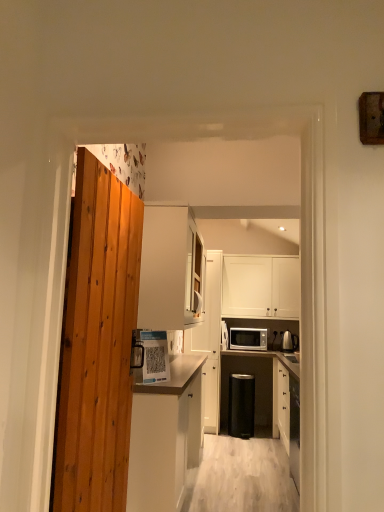
Question: Is white matte cabinet at upper center, the third cabinetry positioned from the right, to the right of white matte cabinet at center, arranged as the fourth cabinetry when viewed from the right, from the viewer's perspective?

Choices:
 (A) no
 (B) yes

Answer: (B)

Question: Is white matte cabinet at upper center, the third cabinetry positioned from the right, behind white matte cabinet at center, arranged as the fourth cabinetry when viewed from the right?

Choices:
 (A) no
 (B) yes

Answer: (B)

Question: Does white matte cabinet at upper center, the third cabinetry positioned from the right, have a smaller size compared to white matte cabinet at center, arranged as the fourth cabinetry when viewed from the right?

Choices:
 (A) no
 (B) yes

Answer: (B)

Question: Does white matte cabinet at upper center, the third cabinetry positioned from the right, have a lesser height compared to white matte cabinet at center, arranged as the fourth cabinetry when viewed from the right?

Choices:
 (A) yes
 (B) no

Answer: (A)

Question: Considering the relative sizes of white matte cabinet at upper center, the second cabinetry viewed from the left, and white matte cabinet at center, arranged as the fourth cabinetry when viewed from the right, in the image provided, is white matte cabinet at upper center, the second cabinetry viewed from the left, taller than white matte cabinet at center, arranged as the fourth cabinetry when viewed from the right,?

Choices:
 (A) yes
 (B) no

Answer: (B)

Question: Considering the positions of white glossy paper at center, the first appliance viewed from the left, and white matte cabinet at upper center, the third cabinetry positioned from the right, in the image, is white glossy paper at center, the first appliance viewed from the left, bigger or smaller than white matte cabinet at upper center, the third cabinetry positioned from the right,?

Choices:
 (A) big
 (B) small

Answer: (B)

Question: Relative to white matte cabinet at upper center, the second cabinetry viewed from the left, is white glossy paper at center, the first appliance viewed from the left, in front or behind?

Choices:
 (A) behind
 (B) front

Answer: (B)

Question: In terms of height, does white glossy paper at center, the 3th appliance in the back-to-front sequence, look taller or shorter compared to white matte cabinet at upper center, the third cabinetry positioned from the right?

Choices:
 (A) short
 (B) tall

Answer: (A)

Question: From a real-world perspective, is white glossy paper at center, the 3th appliance in the back-to-front sequence, above or below white matte cabinet at upper center, the third cabinetry positioned from the right?

Choices:
 (A) above
 (B) below

Answer: (B)

Question: Is matte white microwave at center in front of or behind metallic silver kettle at right, placed as the 1th appliance when sorted from back to front, in the image?

Choices:
 (A) front
 (B) behind

Answer: (A)

Question: Would you say matte white microwave at center is inside or outside metallic silver kettle at right, the third appliance from the front?

Choices:
 (A) inside
 (B) outside

Answer: (B)

Question: From the image's perspective, is matte white microwave at center located above or below metallic silver kettle at right, placed as the 1th appliance when sorted from back to front?

Choices:
 (A) above
 (B) below

Answer: (B)

Question: From a real-world perspective, is matte white microwave at center physically located above or below metallic silver kettle at right, which is the second appliance from bottom to top?

Choices:
 (A) below
 (B) above

Answer: (B)

Question: Looking at the image, does white glossy paper at center, the first appliance viewed from the left, seem bigger or smaller compared to matte white microwave at center?

Choices:
 (A) small
 (B) big

Answer: (A)

Question: Would you say white glossy paper at center, the third appliance positioned from the right, is to the left or to the right of matte white microwave at center in the picture?

Choices:
 (A) left
 (B) right

Answer: (A)